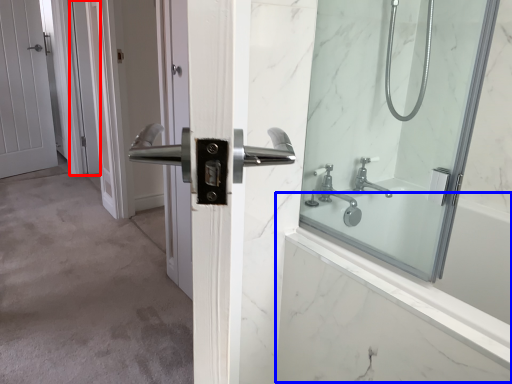
Question: Which object appears closest to the camera in this image, screen door (highlighted by a red box) or bath (highlighted by a blue box)?

Choices:
 (A) screen door
 (B) bath

Answer: (B)